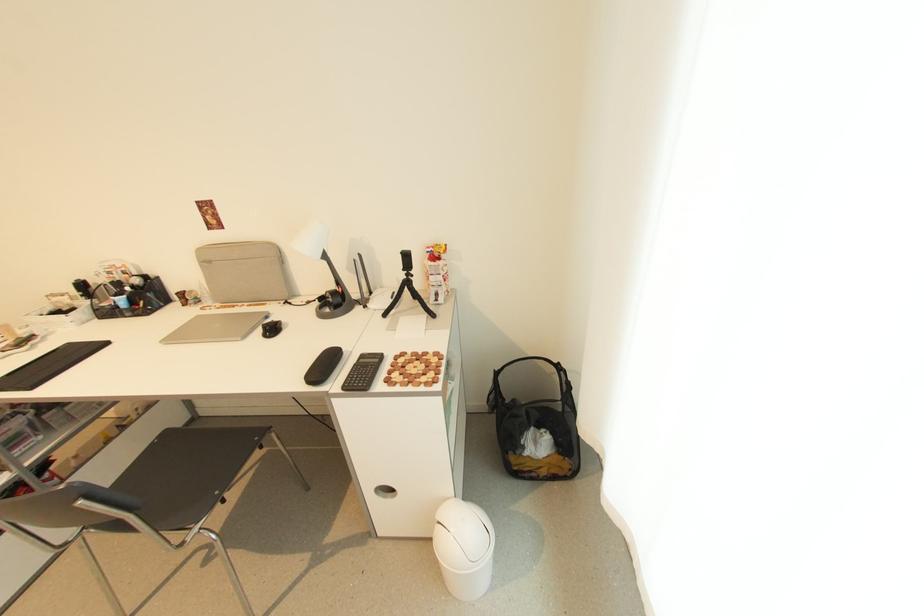
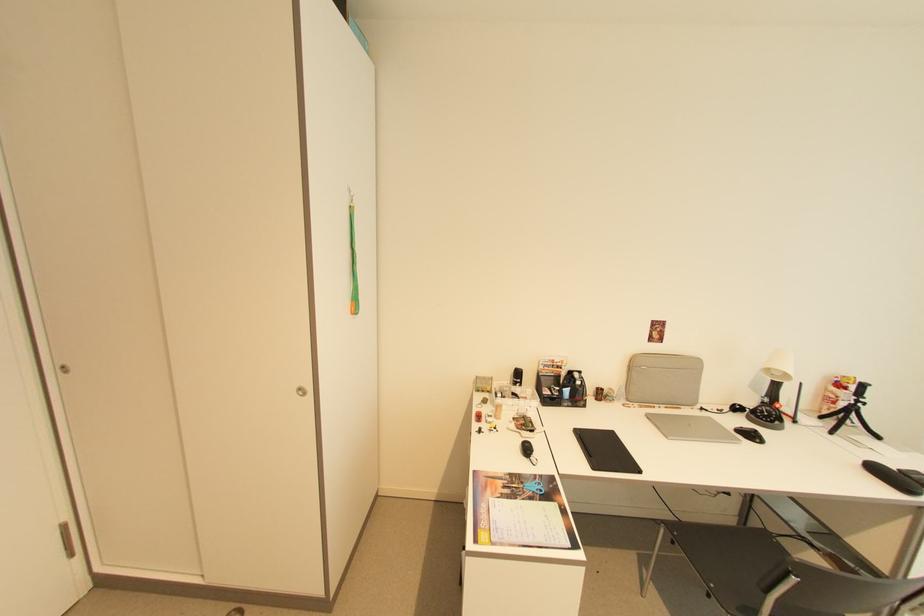
Question: The images are taken continuously from a first-person perspective. In which direction are you moving?

Choices:
 (A) Left
 (B) Right
 (C) Forward
 (D) Backward

Answer: (A)